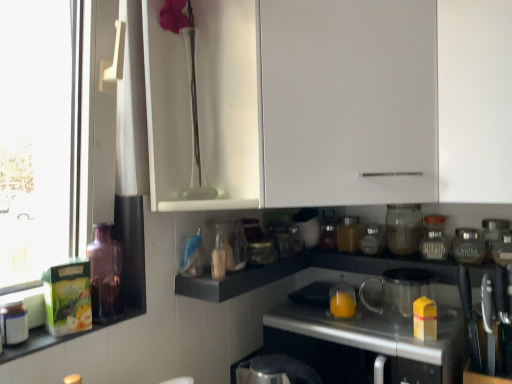
I want to click on free spot to the left of translucent glass blender at lower center, placed as the 3th appliance when sorted from left to right, so click(x=336, y=324).